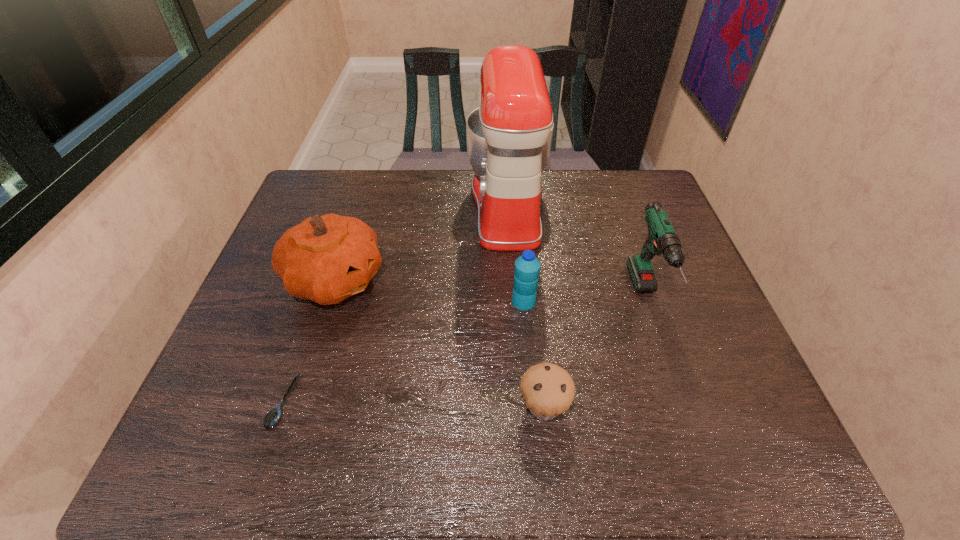
Where is `free space that is in between the rightmost object and the muffin`? The image size is (960, 540). free space that is in between the rightmost object and the muffin is located at coordinates (595, 352).

At what (x,y) coordinates should I click in order to perform the action: click on unoccupied position between the muffin and the pumpkin. Please return your answer as a coordinate pair (x, y). Looking at the image, I should click on (440, 343).

What are the coordinates of `free point between the fourth tallest object and the muffin` in the screenshot? It's located at (534, 354).

Find the location of a particular element. empty location between the drill and the muffin is located at coordinates (595, 352).

Locate an element on the screen. The height and width of the screenshot is (540, 960). empty space between the rightmost object and the muffin is located at coordinates (595, 352).

Locate an element on the screen. The width and height of the screenshot is (960, 540). vacant space that's between the fourth tallest object and the tallest object is located at coordinates (516, 254).

You are a GUI agent. You are given a task and a screenshot of the screen. Output one action in this format:
    pyautogui.click(x=<x>, y=<y>)
    Task: Click on the object that is the third closest one to the rightmost object
    The height and width of the screenshot is (540, 960).
    Given the screenshot: What is the action you would take?
    pyautogui.click(x=527, y=267)

Identify the location of object that stands as the second closest to the mixer. (662, 238).

At what (x,y) coordinates should I click in order to perform the action: click on free space that satisfies the following two spatial constraints: 1. on the front side of the soupspoon; 2. on the left side of the muffin. Please return your answer as a coordinate pair (x, y). The height and width of the screenshot is (540, 960). Looking at the image, I should click on (282, 407).

Where is `free space that satisfies the following two spatial constraints: 1. on the front-facing side of the muffin; 2. on the right side of the pumpkin`? The width and height of the screenshot is (960, 540). free space that satisfies the following two spatial constraints: 1. on the front-facing side of the muffin; 2. on the right side of the pumpkin is located at coordinates (295, 407).